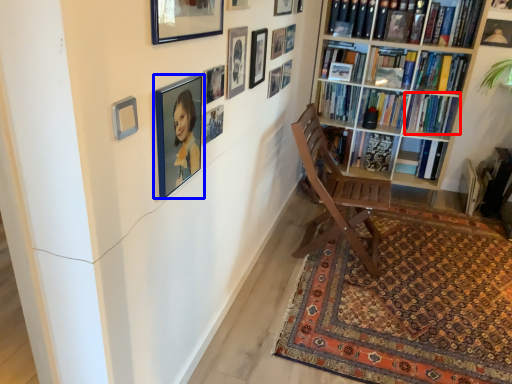
Question: Which object is closer to the camera taking this photo, book (highlighted by a red box) or picture frame (highlighted by a blue box)?

Choices:
 (A) book
 (B) picture frame

Answer: (B)